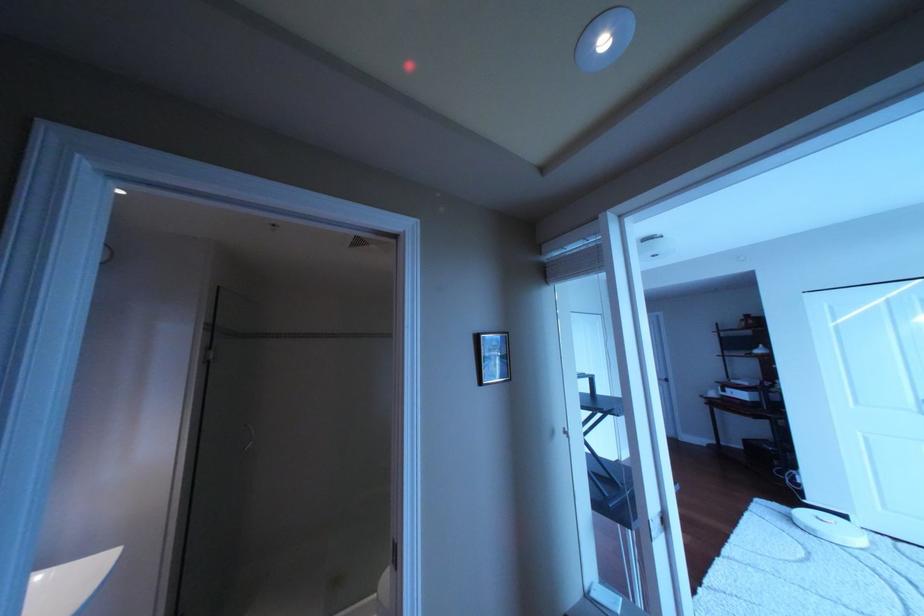
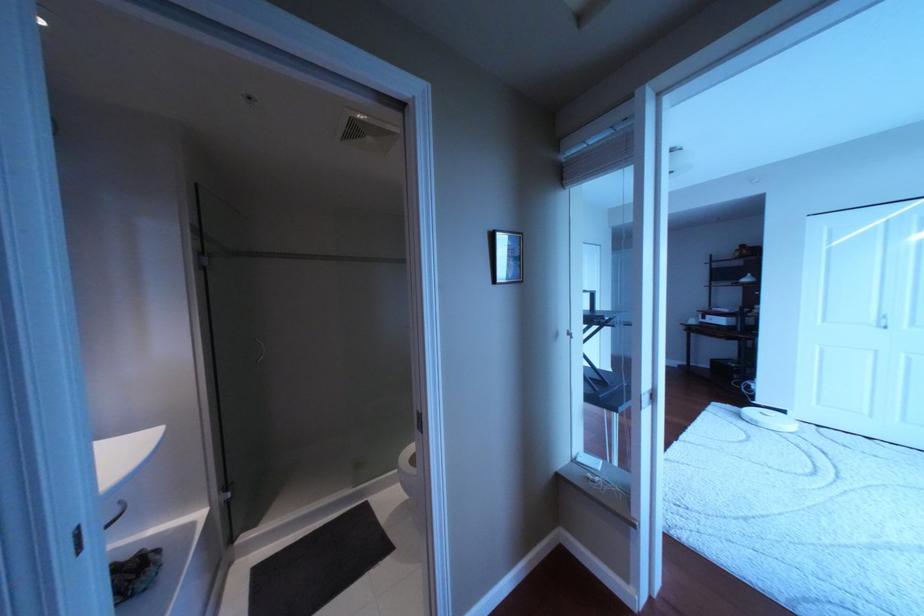
Question: The images are taken continuously from a first-person perspective. In which direction are you moving?

Choices:
 (A) Left
 (B) Right
 (C) Forward
 (D) Backward

Answer: (A)